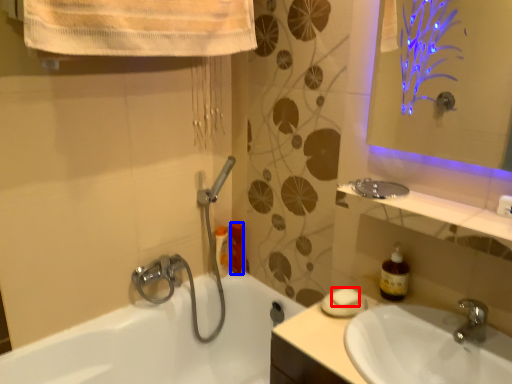
Question: Which object appears closest to the camera in this image, soap (highlighted by a red box) or toiletry (highlighted by a blue box)?

Choices:
 (A) soap
 (B) toiletry

Answer: (A)